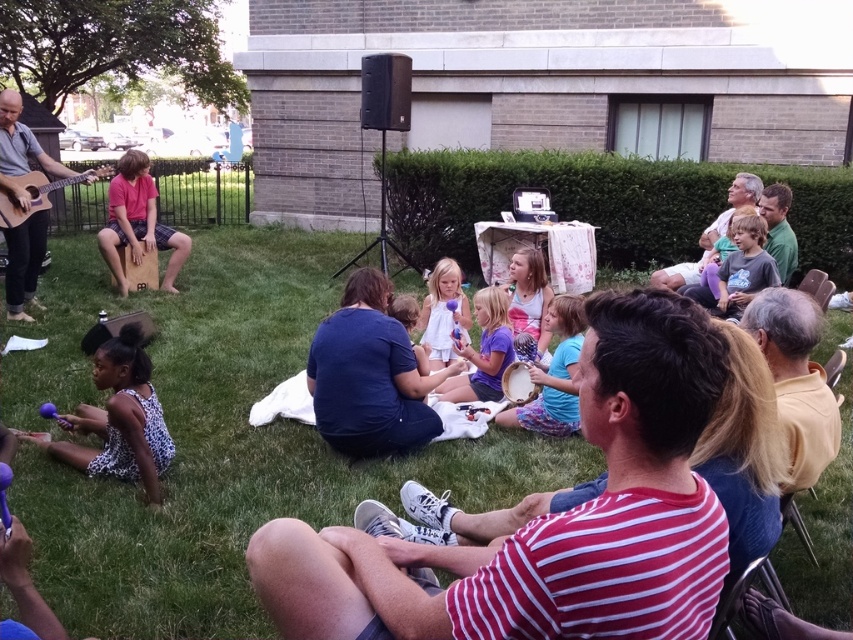
Does pink matte cajon at center lie in front of matte black guitar at left?

No, pink matte cajon at center is further to the viewer.

Is pink matte cajon at center further to the viewer compared to matte black guitar at left?

Yes, pink matte cajon at center is further from the viewer.

The width and height of the screenshot is (853, 640). In order to click on pink matte cajon at center in this screenshot , I will do `click(137, 221)`.

Can you confirm if striped cotton shirt at center is taller than white cotton shirt at center?

Incorrect, striped cotton shirt at center's height is not larger of white cotton shirt at center's.

Does striped cotton shirt at center appear on the right side of white cotton shirt at center?

No, striped cotton shirt at center is not to the right of white cotton shirt at center.

Is point (312, 532) farther from camera compared to point (529, 330)?

That is False.

Locate an element on the screen. The width and height of the screenshot is (853, 640). striped cotton shirt at center is located at coordinates (550, 516).

In the scene shown: Can you confirm if purple matte drum at center is positioned below matte white dress at center?

Correct, purple matte drum at center is located below matte white dress at center.

Is purple matte drum at center in front of matte white dress at center?

No, it is not.

Is point (485, 300) positioned after point (444, 342)?

No, it is in front of (444, 342).

Find the location of `purple matte drum at center`. purple matte drum at center is located at coordinates (483, 352).